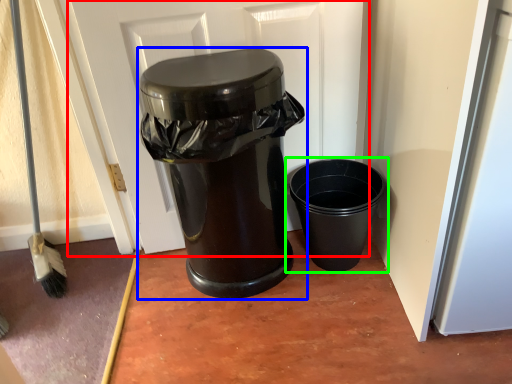
Question: Based on their relative distances, which object is nearer to screen door (highlighted by a red box)? Choose from waste container (highlighted by a blue box) and waste container (highlighted by a green box).

Choices:
 (A) waste container
 (B) waste container

Answer: (A)